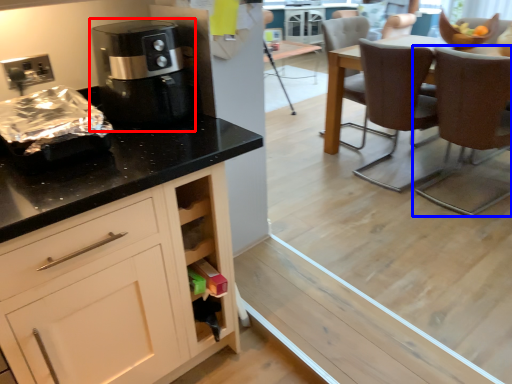
Question: Which object is further to the camera taking this photo, coffee machine (highlighted by a red box) or chair (highlighted by a blue box)?

Choices:
 (A) coffee machine
 (B) chair

Answer: (B)